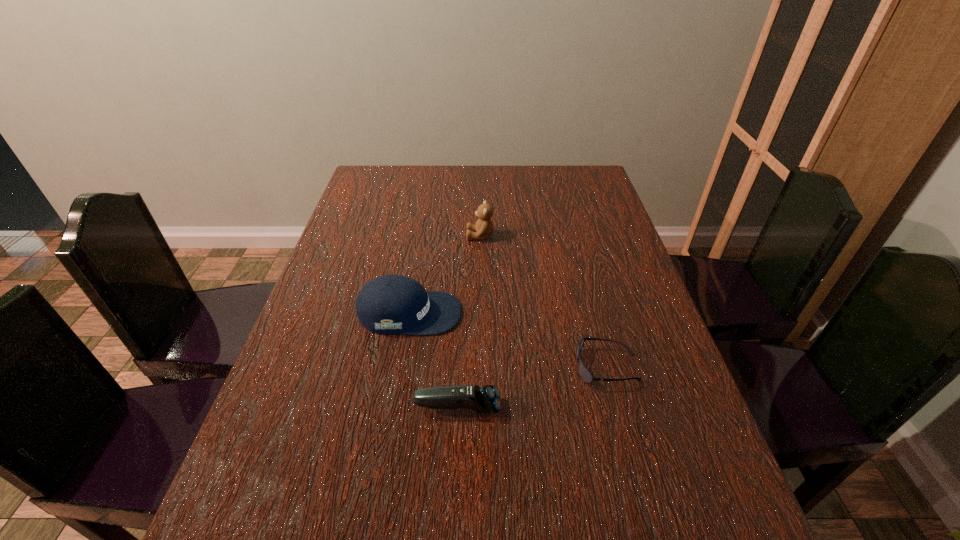
Find the location of a particular element. the farthest object is located at coordinates (484, 226).

This screenshot has width=960, height=540. What are the coordinates of `the second farthest object` in the screenshot? It's located at (389, 304).

The height and width of the screenshot is (540, 960). I want to click on electric shaver, so click(x=486, y=399).

You are a GUI agent. You are given a task and a screenshot of the screen. Output one action in this format:
    pyautogui.click(x=<x>, y=<y>)
    Task: Click on the nearest object
    Image resolution: width=960 pixels, height=540 pixels.
    Given the screenshot: What is the action you would take?
    pyautogui.click(x=486, y=399)

Locate an element on the screen. Image resolution: width=960 pixels, height=540 pixels. the third farthest object is located at coordinates (585, 374).

Locate an element on the screen. Image resolution: width=960 pixels, height=540 pixels. the shortest object is located at coordinates (585, 374).

Identify the location of free space located on the front-facing side of the teddy bear. Image resolution: width=960 pixels, height=540 pixels. (412, 236).

Image resolution: width=960 pixels, height=540 pixels. I want to click on vacant space situated on the front-facing side of the teddy bear, so click(x=398, y=236).

Locate an element on the screen. The height and width of the screenshot is (540, 960). vacant region located on the front-facing side of the teddy bear is located at coordinates (409, 236).

Identify the location of vacant space located 0.090m on the front-facing side of the third nearest object. This screenshot has height=540, width=960. (499, 313).